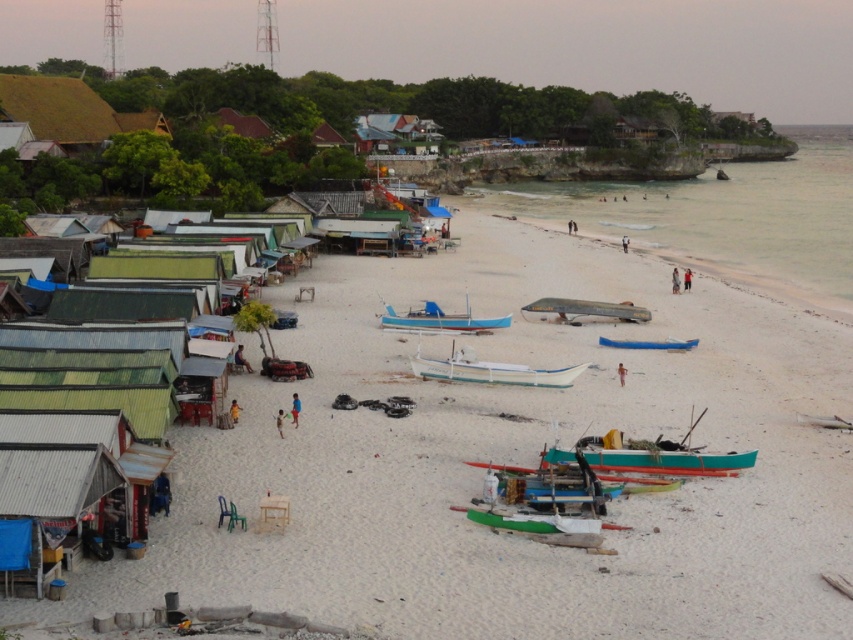
Between point (253, 385) and point (668, 458), which one is positioned behind?

Point (253, 385)

This screenshot has height=640, width=853. I want to click on white sandy beach at center, so 512,464.

The image size is (853, 640). I want to click on white sandy beach at center, so click(x=512, y=464).

Is white plastic boat at center taller than wooden blue boat at center?

Incorrect, white plastic boat at center's height is not larger of wooden blue boat at center's.

Which is behind, point (503, 384) or point (415, 317)?

The point (415, 317) is behind.

Is point (485, 371) farther from camera compared to point (439, 314)?

No, it is not.

Find the location of a particular element. This screenshot has height=640, width=853. white plastic boat at center is located at coordinates (492, 371).

Locate an element on the screen. The image size is (853, 640). wooden blue boat at center is located at coordinates (439, 320).

Does point (442, 328) come farther from viewer compared to point (680, 340)?

Yes, point (442, 328) is farther from viewer.

Which is behind, point (408, 323) or point (646, 348)?

The point (408, 323) is more distant.

Locate an element on the screen. The width and height of the screenshot is (853, 640). wooden blue boat at center is located at coordinates (439, 320).